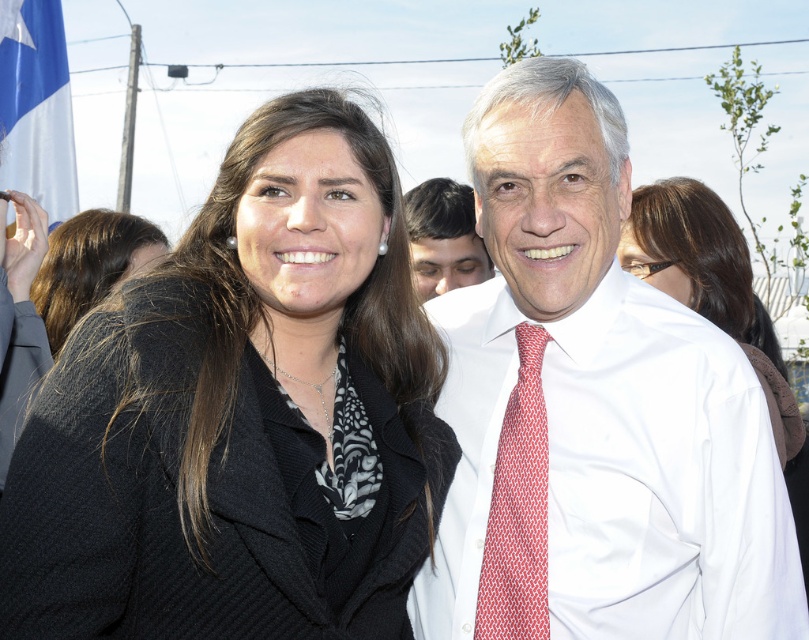
Question: Which object is the closest to the black wool coat at center?

Choices:
 (A) black silk coat at upper center
 (B) red woven tie at center
 (C) smooth skin face at center

Answer: (C)

Question: Can you confirm if black wool coat at left is positioned below blue fabric flag at upper left?

Choices:
 (A) yes
 (B) no

Answer: (A)

Question: Among these objects, which one is farthest from the camera?

Choices:
 (A) black silk coat at upper center
 (B) black wool coat at center

Answer: (B)

Question: Which object is closer to the camera taking this photo?

Choices:
 (A) black silk coat at upper center
 (B) black wool coat at left
 (C) blue fabric flag at upper left

Answer: (B)

Question: Can you confirm if white smooth shirt at center is wider than smooth skin face at center?

Choices:
 (A) yes
 (B) no

Answer: (A)

Question: Can you confirm if black wool coat at left is smaller than black silk coat at upper center?

Choices:
 (A) yes
 (B) no

Answer: (B)